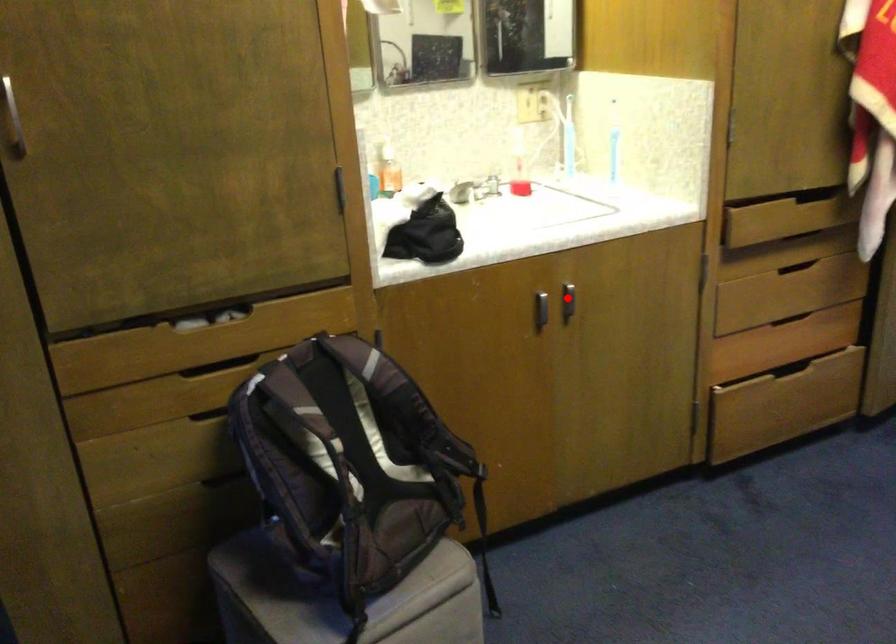
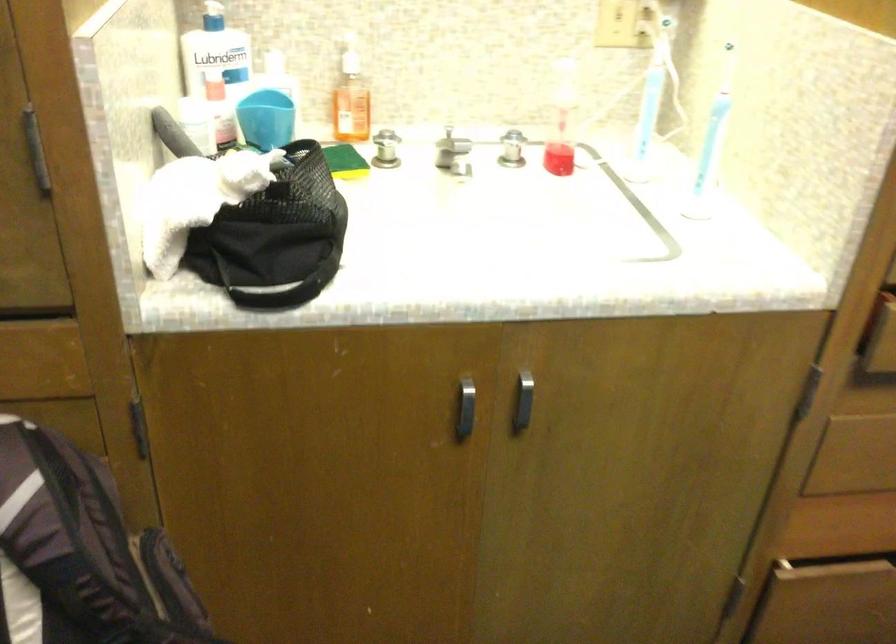
Where in the second image is the point corresponding to the highlighted location from the first image?

(522, 402)